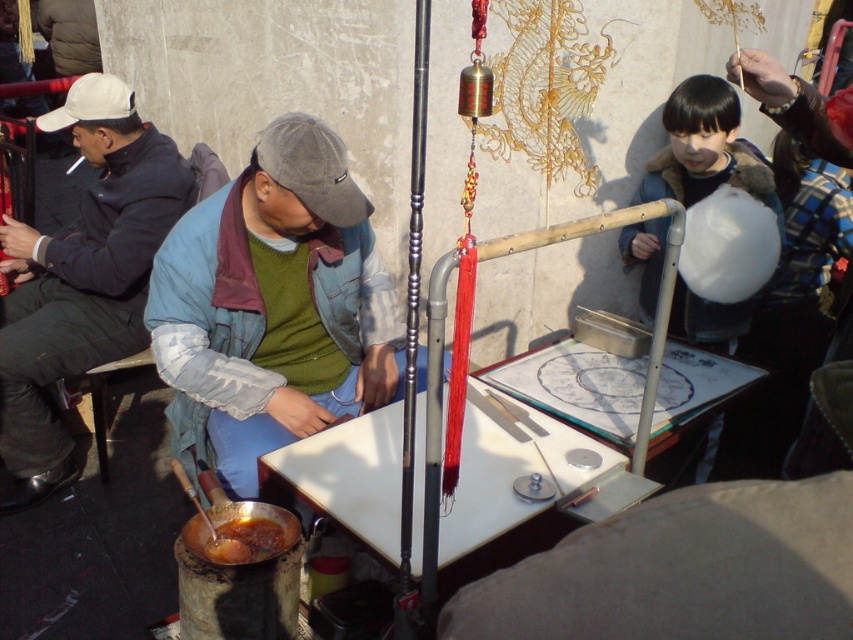
Is green fabric jacket at center to the right of dark blue jacket at left from the viewer's perspective?

Indeed, green fabric jacket at center is positioned on the right side of dark blue jacket at left.

Which is in front, point (184, 358) or point (77, 465)?

Point (184, 358) is in front.

Find the location of a particular element. The height and width of the screenshot is (640, 853). green fabric jacket at center is located at coordinates (x=271, y=307).

Can you confirm if smooth beige cushion at lower right is positioned above white cotton candy at right?

Actually, smooth beige cushion at lower right is below white cotton candy at right.

In the scene shown: Who is positioned more to the right, smooth beige cushion at lower right or white cotton candy at right?

Positioned to the right is white cotton candy at right.

Between point (674, 632) and point (714, 154), which one is positioned behind?

The point (714, 154) is more distant.

I want to click on smooth beige cushion at lower right, so click(682, 570).

Does dark blue jacket at left have a greater width compared to white cotton candy at right?

Indeed, dark blue jacket at left has a greater width compared to white cotton candy at right.

Does dark blue jacket at left appear on the left side of white cotton candy at right?

Yes, dark blue jacket at left is to the left of white cotton candy at right.

What do you see at coordinates (80, 276) in the screenshot?
I see `dark blue jacket at left` at bounding box center [80, 276].

Locate an element on the screen. This screenshot has width=853, height=640. dark blue jacket at left is located at coordinates (80, 276).